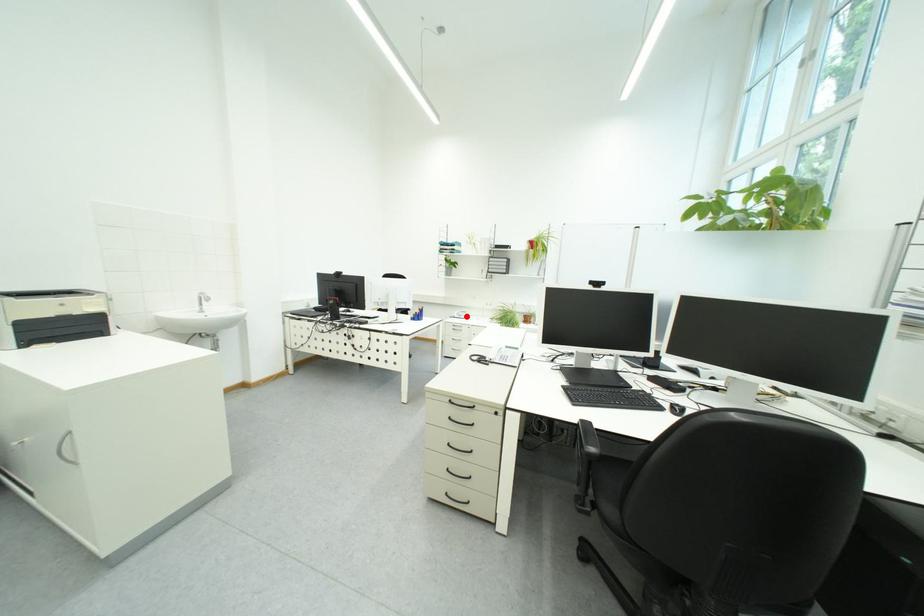
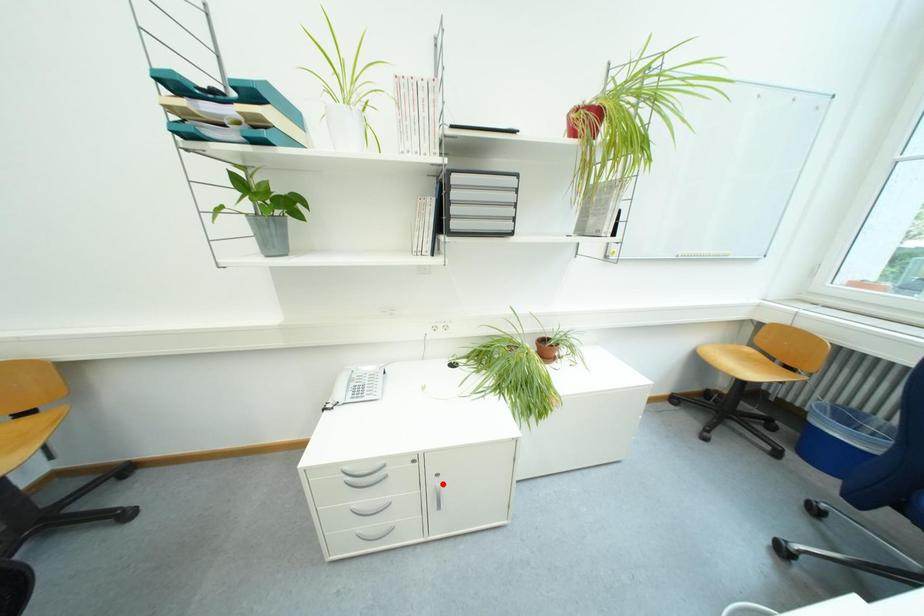
I am providing you with two images of the same scene from different viewpoints. A red point is marked on the first image and another point is marked on the second image. Is the marked point in image1 the same physical position as the marked point in image2?

No